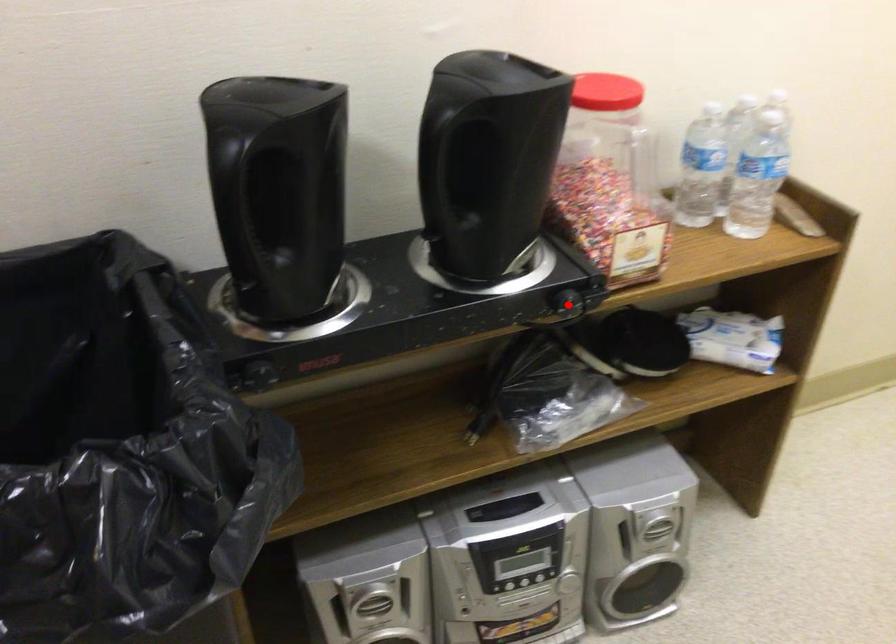
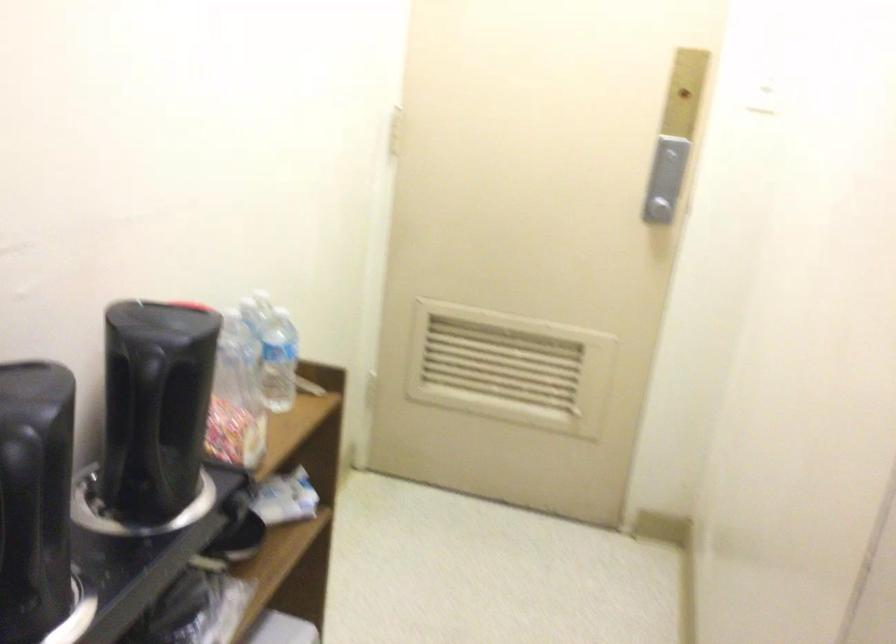
Question: I am providing you with two images of the same scene from different viewpoints. A red point is marked on the first image. Can you still see the location of the red point in image 2?

Choices:
 (A) Yes
 (B) No

Answer: (B)